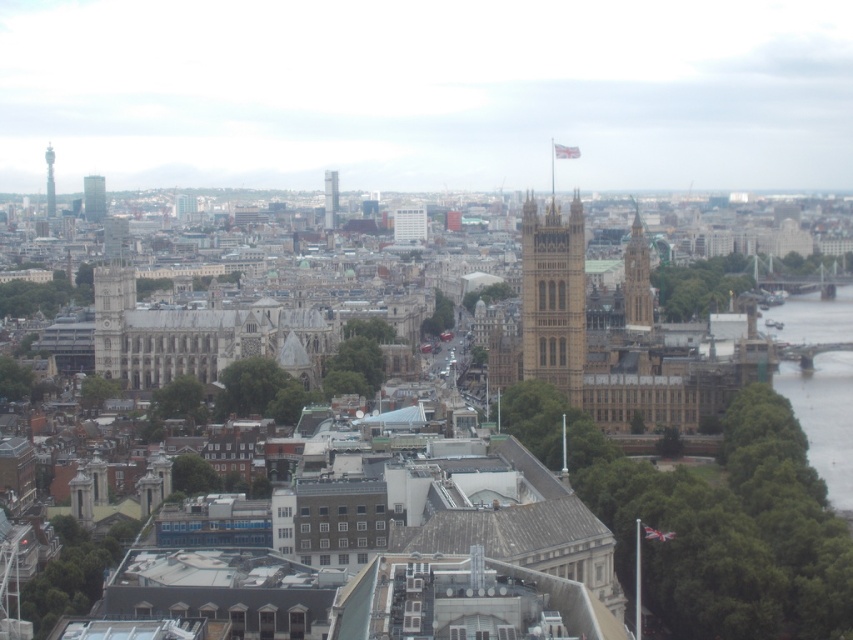
Between golden stone tower at center and smooth glass skyscraper at center, which one is positioned higher?

Positioned higher is smooth glass skyscraper at center.

In the scene shown: Does golden stone tower at center appear over smooth glass skyscraper at center?

Actually, golden stone tower at center is below smooth glass skyscraper at center.

Does point (531, 312) come behind point (332, 192)?

No.

Find the location of a particular element. golden stone tower at center is located at coordinates (553, 298).

Can you confirm if golden stone tower at center right is thinner than glassy reflective skyscraper at upper left?

Yes, golden stone tower at center right is thinner than glassy reflective skyscraper at upper left.

Who is more distant from viewer, (645,256) or (100,186)?

Positioned behind is point (100,186).

You are a GUI agent. You are given a task and a screenshot of the screen. Output one action in this format:
    pyautogui.click(x=<x>, y=<y>)
    Task: Click on the golden stone tower at center right
    Image resolution: width=853 pixels, height=640 pixels.
    Given the screenshot: What is the action you would take?
    pyautogui.click(x=637, y=280)

Is smooth glass skyscraper at center wider than silver metallic tower at left?

No.

Between point (332, 186) and point (51, 176), which one is positioned in front?

Point (332, 186)

You are a GUI agent. You are given a task and a screenshot of the screen. Output one action in this format:
    pyautogui.click(x=<x>, y=<y>)
    Task: Click on the smooth glass skyscraper at center
    
    Given the screenshot: What is the action you would take?
    pyautogui.click(x=331, y=198)